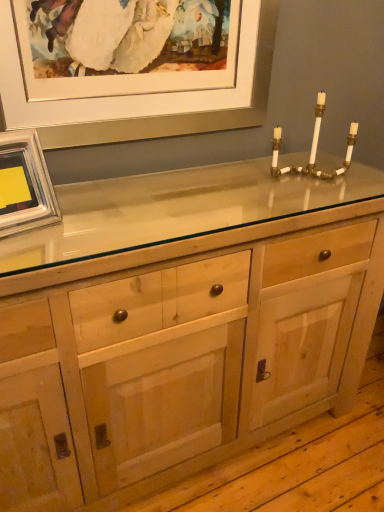
This screenshot has width=384, height=512. Find the location of `free space above natural wood cabinet at center (from a real-world perspective)`. free space above natural wood cabinet at center (from a real-world perspective) is located at coordinates (206, 193).